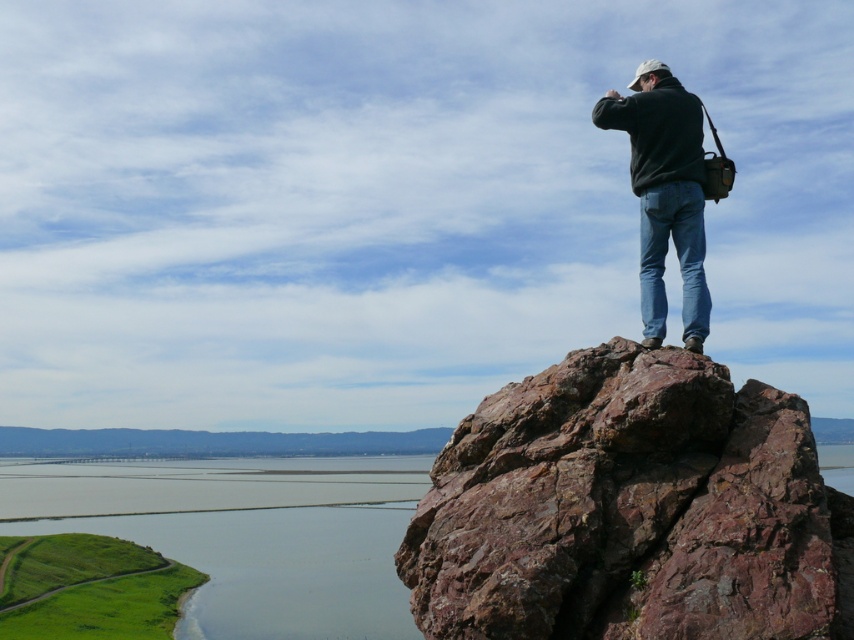
Question: Is rusty rock at upper right to the left of black matte jacket at upper right from the viewer's perspective?

Choices:
 (A) no
 (B) yes

Answer: (B)

Question: Among these points, which one is nearest to the camera?

Choices:
 (A) (642, 634)
 (B) (659, 317)

Answer: (A)

Question: Can you confirm if rusty rock at upper right is positioned above black matte jacket at upper right?

Choices:
 (A) yes
 (B) no

Answer: (B)

Question: Which point appears farthest from the camera in this image?

Choices:
 (A) (791, 490)
 (B) (659, 214)

Answer: (B)

Question: Can you confirm if rusty rock at upper right is positioned to the right of black matte jacket at upper right?

Choices:
 (A) no
 (B) yes

Answer: (A)

Question: Among these objects, which one is nearest to the camera?

Choices:
 (A) rusty rock at upper right
 (B) black matte jacket at upper right

Answer: (A)